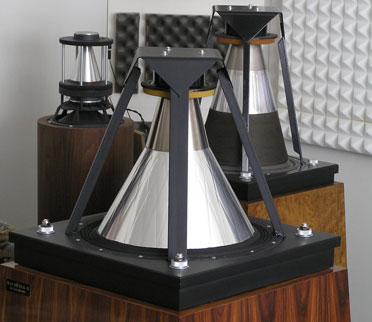
Where is `left corner edge`? The image size is (372, 322). left corner edge is located at coordinates coord(1,152).